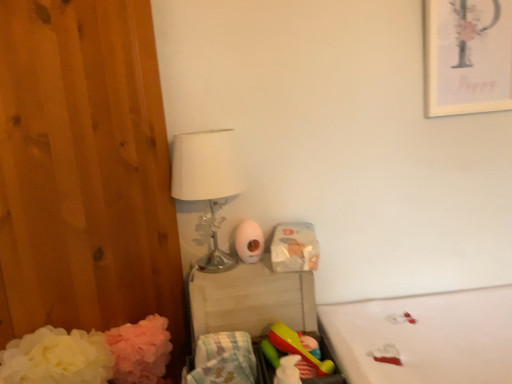
The height and width of the screenshot is (384, 512). Find the location of `free space above plastic changing table at center (from a real-world perspective)`. free space above plastic changing table at center (from a real-world perspective) is located at coordinates (229, 264).